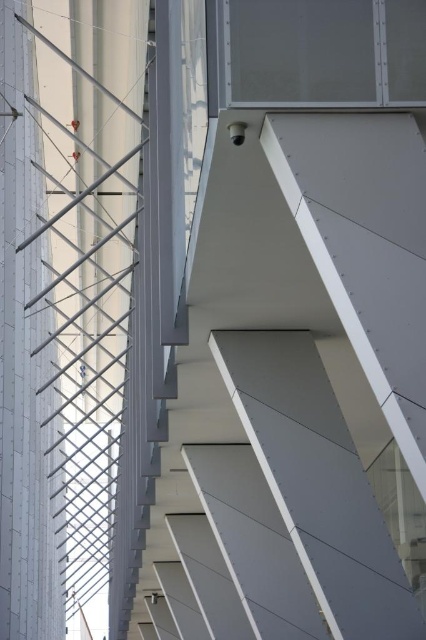
You are an architect examining the structure. You need to determine which object, the white smooth stair at upper center or the white matte pillar at left, would require more material for construction. Based on their sizes, which one would need more material?

The white smooth stair at upper center has a larger size compared to the white matte pillar at left, so it would require more material for construction.

You are an architect examining the building structure. You need to determine if the white smooth stair at upper center is supported by the white matte pillar at left. Based on the scene, can you confirm this?

The white smooth stair at upper center is positioned under the white matte pillar at left, which suggests that the pillar provides structural support to the stair.

You are an architect reviewing the building design. You notice the white smooth stair at upper center and the white matte pillar at left. Which object is located to the right of the other?

The white smooth stair at upper center is positioned on the right side of the white matte pillar at left.